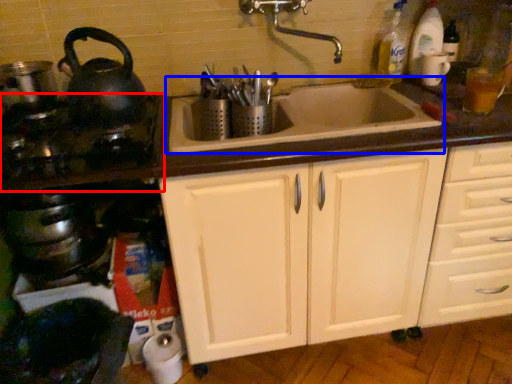
Question: Which of the following is the closest to the observer, gas stove (highlighted by a red box) or sink (highlighted by a blue box)?

Choices:
 (A) gas stove
 (B) sink

Answer: (A)